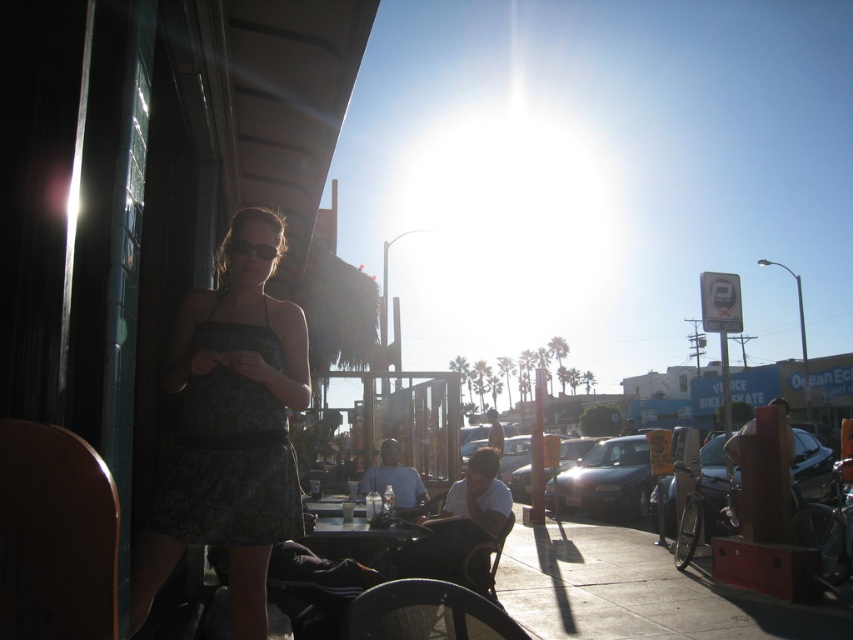
You are a photographer taking a picture of the matte black dress at left and the wooden table at center. Which object should you focus on first if you want to capture both clearly in the same frame?

The matte black dress at left is above the wooden table at center, so focusing on the dress first will ensure both are in focus as the table is below it in the frame.

You are a photographer trying to capture a photo of the matte black dress at left and the wooden table at center. Which object should you focus on first if you want to ensure both are in frame without moving the camera?

The matte black dress at left is taller than the wooden table at center, so you should focus on the taller matte black dress at left first to ensure it fits within the frame.